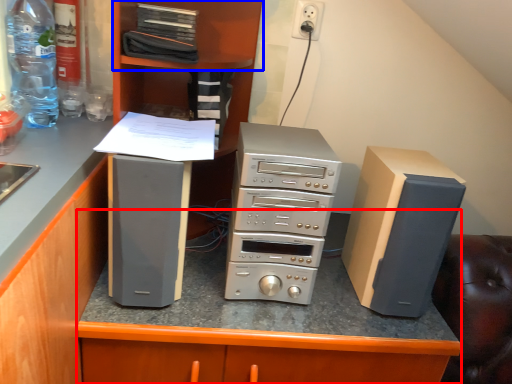
Question: Which of the following is the farthest to the observer, table (highlighted by a red box) or shelf (highlighted by a blue box)?

Choices:
 (A) table
 (B) shelf

Answer: (B)